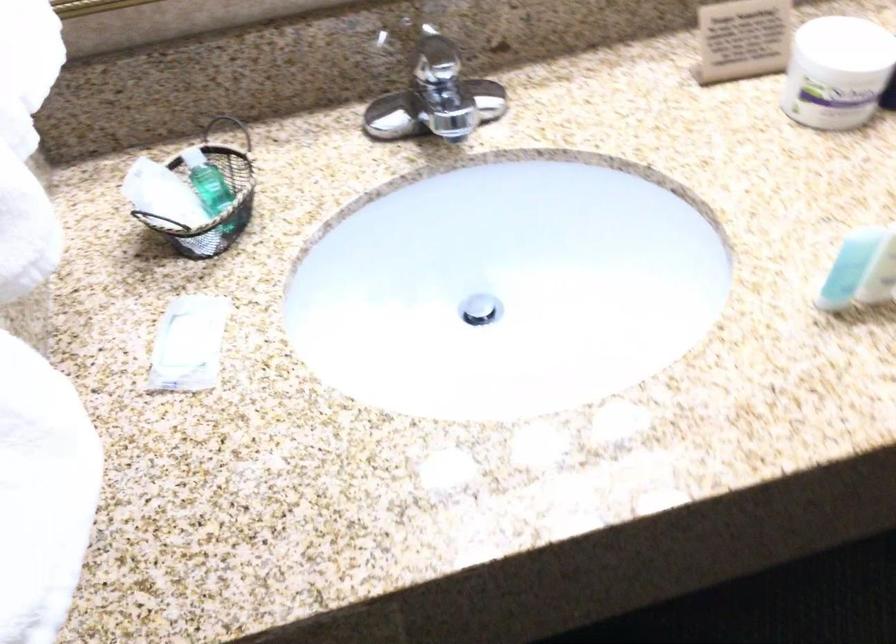
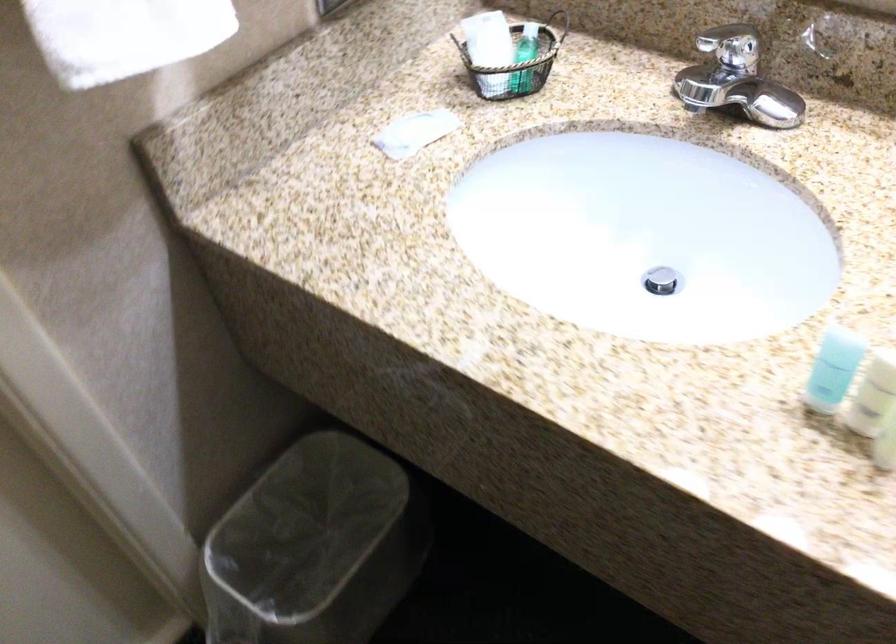
Find the pixel in the second image that matches the point at 188,345 in the first image.

(414, 131)